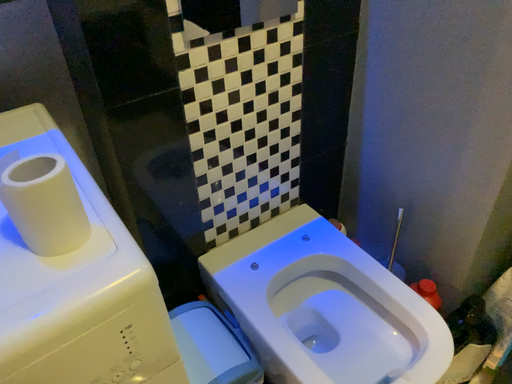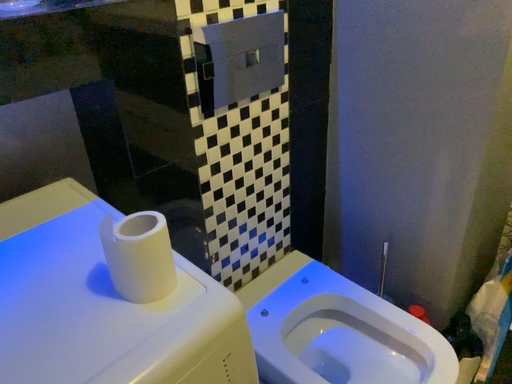
Question: How did the camera likely rotate when shooting the video?

Choices:
 (A) rotated right
 (B) rotated left

Answer: (A)